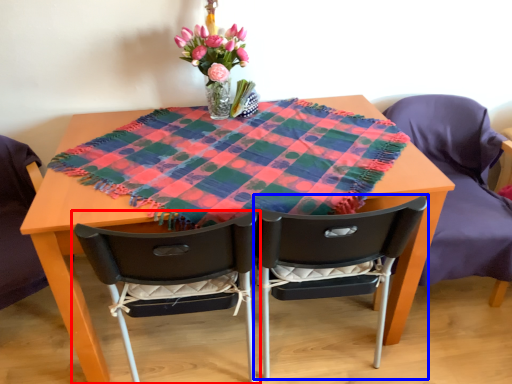
Question: Which object is closer to the camera taking this photo, chair (highlighted by a red box) or chair (highlighted by a blue box)?

Choices:
 (A) chair
 (B) chair

Answer: (A)